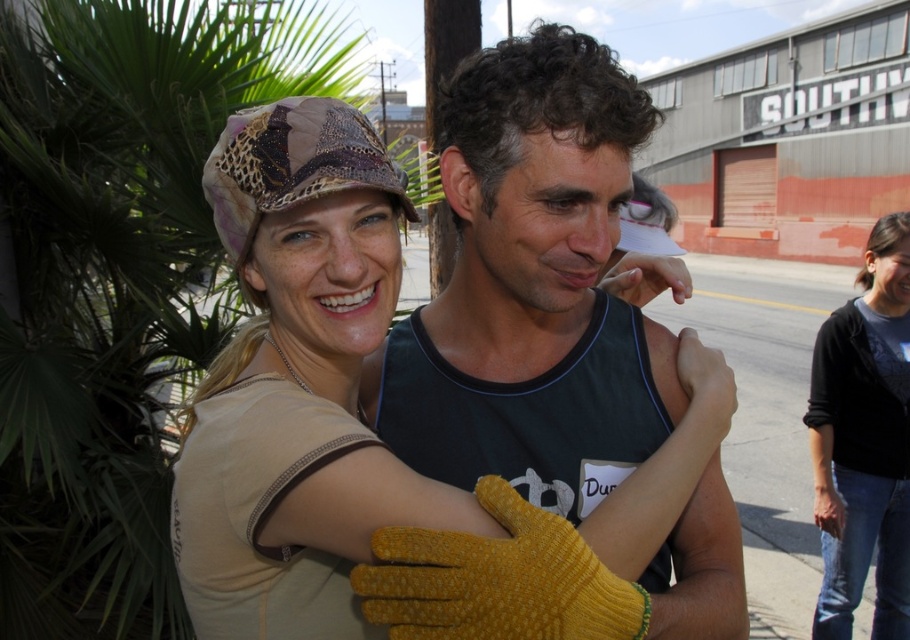
Question: Is matte green tank top at center above black cotton shirt at lower right?

Choices:
 (A) yes
 (B) no

Answer: (A)

Question: Which point appears farthest from the camera in this image?

Choices:
 (A) (819, 344)
 (B) (590, 157)

Answer: (A)

Question: Does matte green tank top at center lie in front of black cotton shirt at lower right?

Choices:
 (A) yes
 (B) no

Answer: (A)

Question: Where is matte green tank top at center located in relation to black cotton shirt at lower right in the image?

Choices:
 (A) left
 (B) right

Answer: (A)